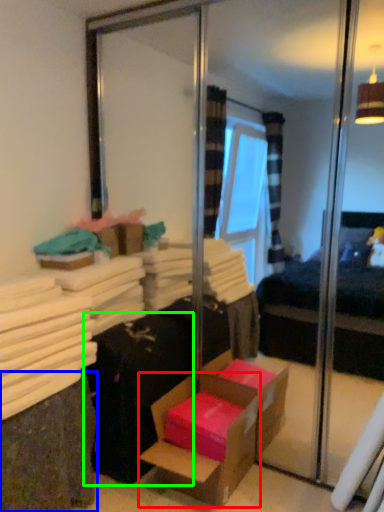
Question: Which object is the farthest from box (highlighted by a red box)? Choose among these: shelf (highlighted by a blue box) or luggage (highlighted by a green box).

Choices:
 (A) shelf
 (B) luggage

Answer: (A)